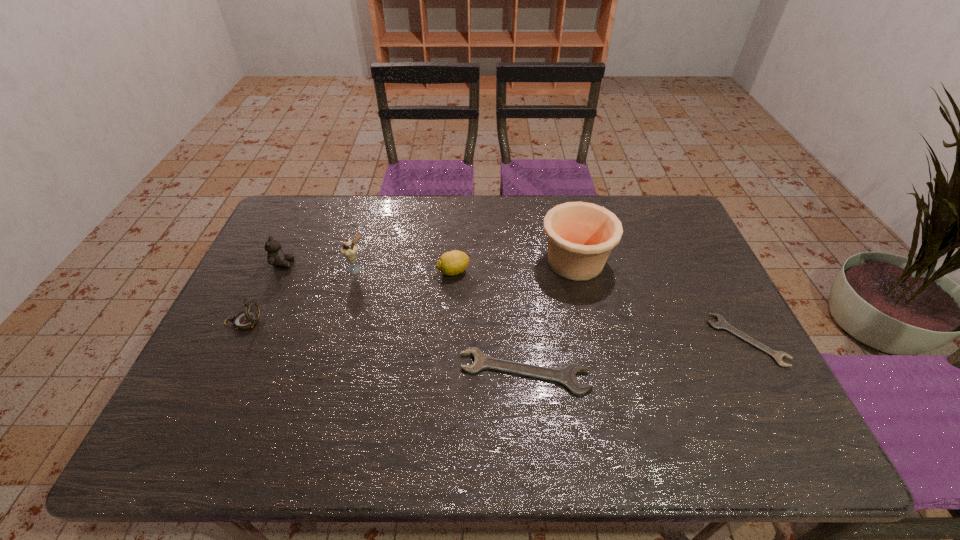
This screenshot has width=960, height=540. I want to click on vacant space situated on the back of the shortest object, so click(x=702, y=254).

In order to click on blank area located 0.130m on the face of the teddy bear in this screenshot , I will do `click(336, 264)`.

Find the location of a particular element. Image resolution: width=960 pixels, height=540 pixels. vacant space located on the left of the third object from left to right is located at coordinates (323, 269).

Where is `vacant area situated 0.170m at the stem end of the lemon`? vacant area situated 0.170m at the stem end of the lemon is located at coordinates (525, 271).

At what (x,y) coordinates should I click in order to perform the action: click on vacant area located 0.060m on the back of the pottery. Please return your answer as a coordinate pair (x, y). Looking at the image, I should click on (567, 227).

Identify the location of free region located on the face of the compass. Image resolution: width=960 pixels, height=540 pixels. (347, 321).

Find the location of a particular element. object present at the near edge is located at coordinates (566, 376).

Where is `teddy bear at the left edge`? The width and height of the screenshot is (960, 540). teddy bear at the left edge is located at coordinates (276, 257).

This screenshot has width=960, height=540. I want to click on compass located at the left edge, so click(x=246, y=319).

Where is `object at the right edge`? object at the right edge is located at coordinates 721,323.